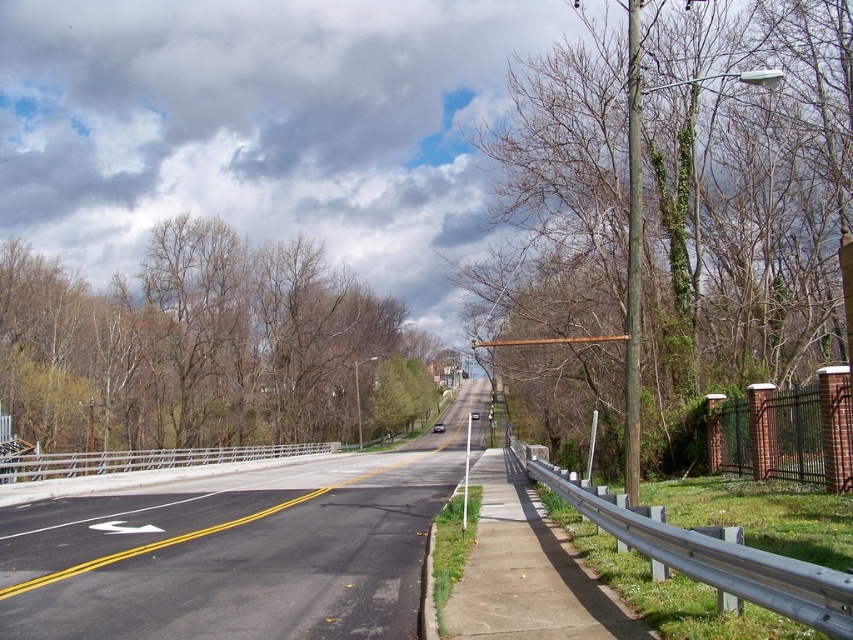
Who is positioned more to the right, green ivy-covered pole at right or black asphalt road at center?

green ivy-covered pole at right

Locate an element on the screen. This screenshot has height=640, width=853. green ivy-covered pole at right is located at coordinates (682, 198).

Is point (579, 349) in front of point (339, 602)?

No, it is not.

You are a GUI agent. You are given a task and a screenshot of the screen. Output one action in this format:
    pyautogui.click(x=<x>, y=<y>)
    Task: Click on the green ivy-covered pole at right
    Image resolution: width=853 pixels, height=640 pixels.
    Given the screenshot: What is the action you would take?
    [682, 198]

Is point (766, 248) farther from camera compared to point (315, 440)?

No.

Can you confirm if green ivy-covered pole at right is wider than brown leafless tree at center?

In fact, green ivy-covered pole at right might be narrower than brown leafless tree at center.

You are a GUI agent. You are given a task and a screenshot of the screen. Output one action in this format:
    pyautogui.click(x=<x>, y=<y>)
    Task: Click on the green ivy-covered pole at right
    The width and height of the screenshot is (853, 640).
    Given the screenshot: What is the action you would take?
    pyautogui.click(x=682, y=198)

Where is `green ivy-covered pole at right`? The height and width of the screenshot is (640, 853). green ivy-covered pole at right is located at coordinates (682, 198).

Which is behind, point (280, 406) or point (476, 445)?

The point (280, 406) is more distant.

Between brown leafless tree at center and black asphalt road at center, which one has more height?

With more height is brown leafless tree at center.

You are a GUI agent. You are given a task and a screenshot of the screen. Output one action in this format:
    pyautogui.click(x=<x>, y=<y>)
    Task: Click on the brown leafless tree at center
    
    Given the screenshot: What is the action you would take?
    pyautogui.click(x=190, y=344)